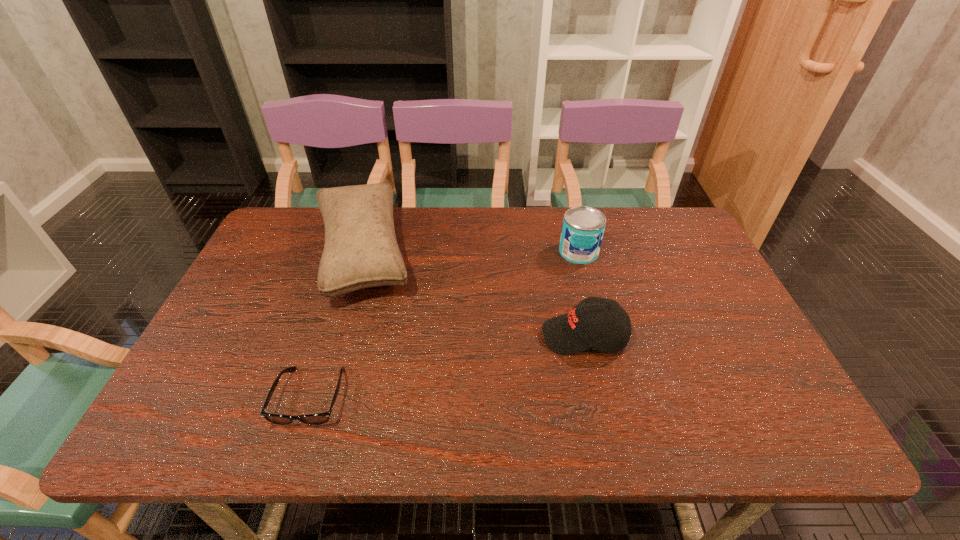
Locate an element on the screen. the tallest object is located at coordinates (361, 251).

Locate an element on the screen. The image size is (960, 540). can is located at coordinates (583, 227).

Locate an element on the screen. the second shortest object is located at coordinates (609, 329).

You are a GUI agent. You are given a task and a screenshot of the screen. Output one action in this format:
    pyautogui.click(x=<x>, y=<y>)
    Task: Click on the second nearest object
    
    Given the screenshot: What is the action you would take?
    pyautogui.click(x=609, y=329)

The image size is (960, 540). I want to click on spectacles, so click(x=312, y=419).

Locate an element on the screen. the nearest object is located at coordinates (x=312, y=419).

Image resolution: width=960 pixels, height=540 pixels. Find the location of `vacant area situated 0.280m on the front of the tallest object`. vacant area situated 0.280m on the front of the tallest object is located at coordinates (314, 411).

Locate an element on the screen. free location located on the left of the can is located at coordinates (460, 252).

The height and width of the screenshot is (540, 960). I want to click on free space located on the front-facing side of the third tallest object, so click(x=453, y=336).

You are a GUI agent. You are given a task and a screenshot of the screen. Output one action in this format:
    pyautogui.click(x=<x>, y=<y>)
    Task: Click on the vacant space located on the front-facing side of the third tallest object
    Image resolution: width=960 pixels, height=540 pixels.
    Given the screenshot: What is the action you would take?
    pyautogui.click(x=449, y=336)